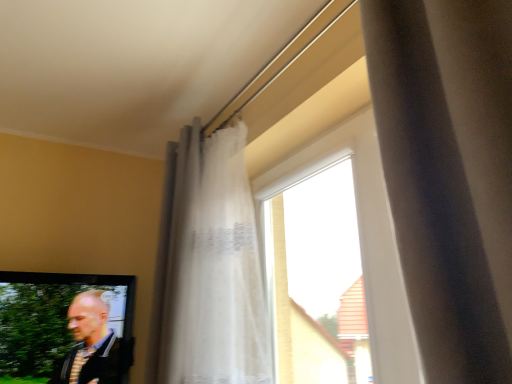
Question: Is transparent glass window at center positioned far away from white sheer curtain at upper center?

Choices:
 (A) no
 (B) yes

Answer: (A)

Question: From a real-world perspective, is transparent glass window at center under white sheer curtain at upper center?

Choices:
 (A) no
 (B) yes

Answer: (B)

Question: Could you tell me if transparent glass window at center is turned towards white sheer curtain at upper center?

Choices:
 (A) yes
 (B) no

Answer: (A)

Question: Does transparent glass window at center have a greater height compared to white sheer curtain at upper center?

Choices:
 (A) yes
 (B) no

Answer: (B)

Question: Considering the relative sizes of transparent glass window at center and white sheer curtain at upper center in the image provided, is transparent glass window at center wider than white sheer curtain at upper center?

Choices:
 (A) no
 (B) yes

Answer: (A)

Question: From the image's perspective, relative to transparent glass window at center, is striped fabric shirt at lower left above or below?

Choices:
 (A) below
 (B) above

Answer: (A)

Question: In terms of size, does striped fabric shirt at lower left appear bigger or smaller than transparent glass window at center?

Choices:
 (A) small
 (B) big

Answer: (B)

Question: In the image, is striped fabric shirt at lower left positioned in front of or behind transparent glass window at center?

Choices:
 (A) front
 (B) behind

Answer: (B)

Question: From a real-world perspective, is striped fabric shirt at lower left physically located above or below transparent glass window at center?

Choices:
 (A) below
 (B) above

Answer: (A)

Question: Do you think transparent glass window at center is within striped fabric shirt at lower left, or outside of it?

Choices:
 (A) inside
 (B) outside

Answer: (B)

Question: From a real-world perspective, relative to striped fabric shirt at lower left, is transparent glass window at center vertically above or below?

Choices:
 (A) below
 (B) above

Answer: (B)

Question: Is transparent glass window at center bigger or smaller than striped fabric shirt at lower left?

Choices:
 (A) small
 (B) big

Answer: (A)

Question: In the image, is transparent glass window at center on the left side or the right side of striped fabric shirt at lower left?

Choices:
 (A) right
 (B) left

Answer: (A)

Question: Visually, is white sheer curtain at upper center positioned to the left or to the right of transparent glass window at center?

Choices:
 (A) right
 (B) left

Answer: (B)

Question: Is white sheer curtain at upper center wider or thinner than transparent glass window at center?

Choices:
 (A) wide
 (B) thin

Answer: (A)